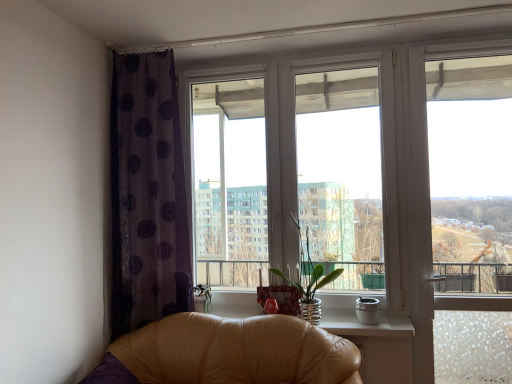
Question: Would you say clear glass vase at center is inside or outside clear glass window at upper right?

Choices:
 (A) outside
 (B) inside

Answer: (A)

Question: Considering the relative positions of clear glass vase at center and clear glass window at upper right in the image provided, is clear glass vase at center to the left or to the right of clear glass window at upper right?

Choices:
 (A) right
 (B) left

Answer: (B)

Question: Which of these objects is positioned closest to the clear glass vase at center?

Choices:
 (A) clear glass window at upper right
 (B) transparent glass window at center
 (C) leather chair at lower left
 (D) purple sheer curtain at left

Answer: (B)

Question: Considering the real-world distances, which object is closest to the clear glass vase at center?

Choices:
 (A) transparent glass window at center
 (B) clear glass window at upper right
 (C) purple sheer curtain at left
 (D) leather chair at lower left

Answer: (A)